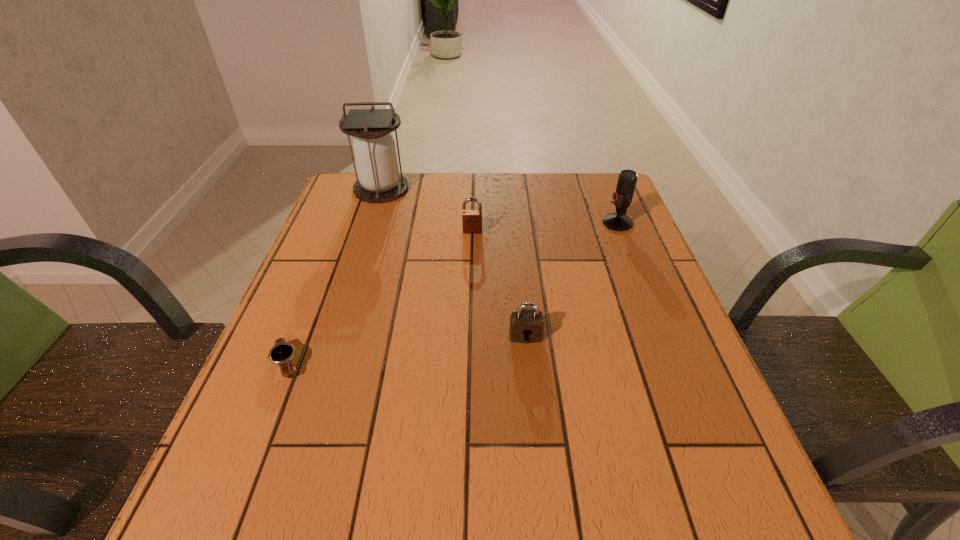
This screenshot has height=540, width=960. I want to click on free space between the right padlock and the nearest object, so click(x=406, y=349).

Image resolution: width=960 pixels, height=540 pixels. What are the coordinates of `free spot between the microphone and the second nearest object` in the screenshot? It's located at (571, 279).

Where is `free space between the lantern and the watch`? This screenshot has width=960, height=540. free space between the lantern and the watch is located at coordinates (334, 276).

Identify the location of vacant area that lies between the third object from left to right and the nearer padlock. (499, 284).

Locate an element on the screen. Image resolution: width=960 pixels, height=540 pixels. vacant space that is in between the left padlock and the tallest object is located at coordinates (427, 210).

I want to click on vacant space that is in between the left padlock and the microphone, so click(545, 227).

Locate an element on the screen. The height and width of the screenshot is (540, 960). free space between the nearest object and the farthest object is located at coordinates (334, 276).

What are the coordinates of `free point between the rightmost object and the farthest object` in the screenshot? It's located at (499, 206).

What are the coordinates of `free space between the second nearest object and the nearest object` in the screenshot? It's located at (406, 349).

Identify the location of object that stands as the third closest to the microphone. This screenshot has width=960, height=540. [379, 181].